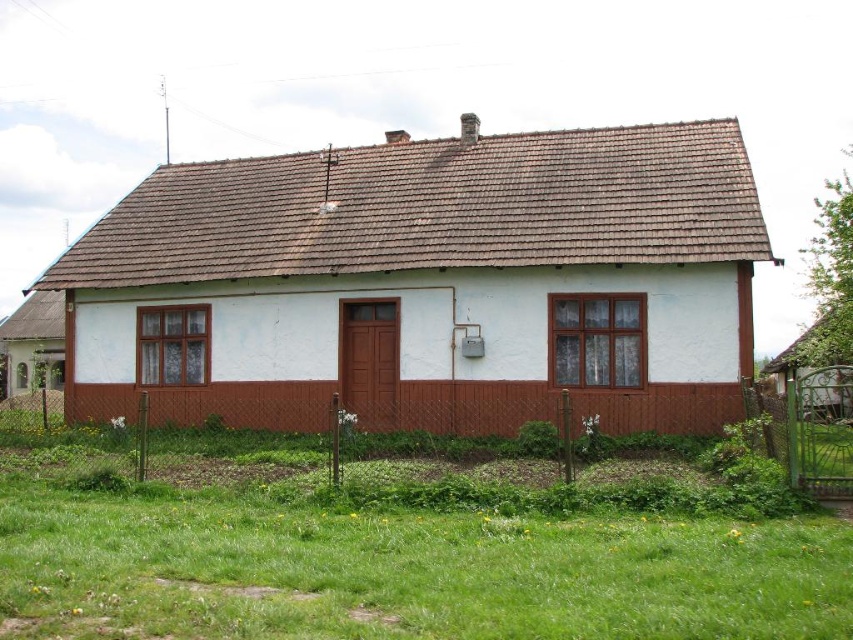
In the scene shown: Who is higher up, green grass at lower center or white painted wood cottage at lower left?

white painted wood cottage at lower left is above.

This screenshot has height=640, width=853. Describe the element at coordinates (403, 547) in the screenshot. I see `green grass at lower center` at that location.

Does point (521, 497) lie behind point (26, 332)?

No, (521, 497) is closer to viewer.

The height and width of the screenshot is (640, 853). In order to click on green grass at lower center in this screenshot , I will do `click(403, 547)`.

Who is higher up, white painted wood cottage at center or green grass at lower center?

Positioned higher is white painted wood cottage at center.

What do you see at coordinates (428, 284) in the screenshot?
I see `white painted wood cottage at center` at bounding box center [428, 284].

Locate an element on the screen. white painted wood cottage at center is located at coordinates (428, 284).

Measure the distance between white painted wood cottage at center and white painted wood cottage at lower left.

They are 8.83 meters apart.

Is white painted wood cottage at center bigger than white painted wood cottage at lower left?

Incorrect, white painted wood cottage at center is not larger than white painted wood cottage at lower left.

The width and height of the screenshot is (853, 640). I want to click on white painted wood cottage at center, so click(428, 284).